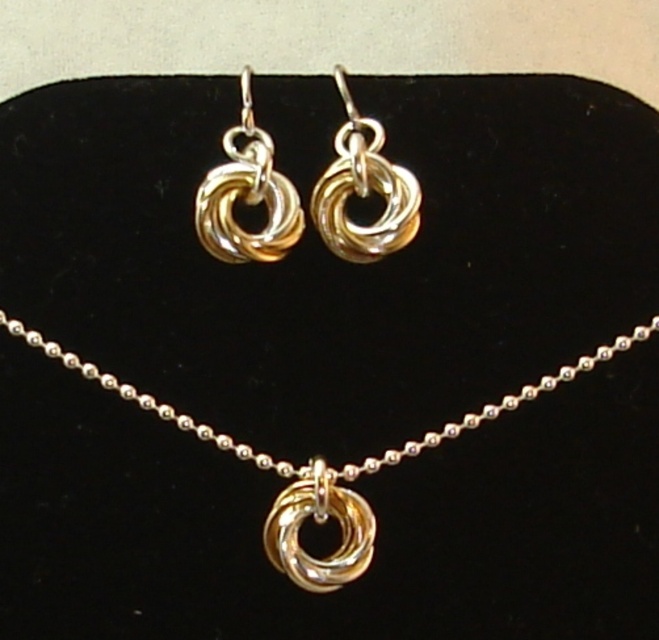
You are a customer at a jewelry store looking at the gold shiny knot at upper center and the gold shiny knot at upper left. Which one would you choose if you want the bigger one?

The gold shiny knot at upper center is larger in size than the gold shiny knot at upper left, so you should choose the gold shiny knot at upper center.